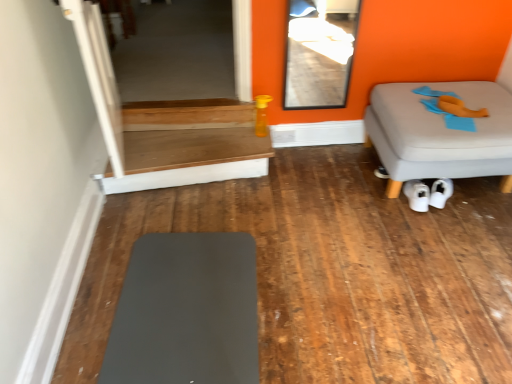
Locate an element on the screen. The image size is (512, 384). vacant space to the right of white matte sneakers at lower center is located at coordinates (458, 209).